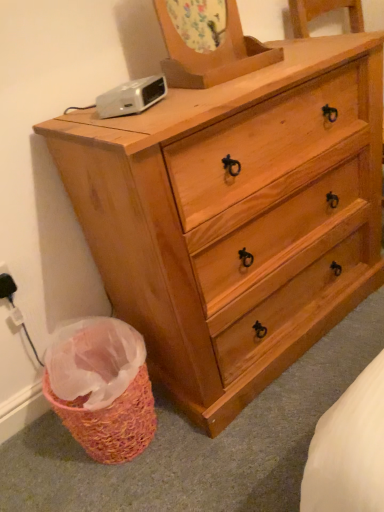
Question: Is black plastic electric outlet at lower left far away from natural wood dresser at center?

Choices:
 (A) yes
 (B) no

Answer: (B)

Question: Is black plastic electric outlet at lower left turned away from natural wood dresser at center?

Choices:
 (A) yes
 (B) no

Answer: (B)

Question: Can we say black plastic electric outlet at lower left lies outside natural wood dresser at center?

Choices:
 (A) yes
 (B) no

Answer: (A)

Question: Is black plastic electric outlet at lower left wider than natural wood dresser at center?

Choices:
 (A) yes
 (B) no

Answer: (B)

Question: From the image's perspective, does black plastic electric outlet at lower left appear lower than natural wood dresser at center?

Choices:
 (A) yes
 (B) no

Answer: (A)

Question: Is point coord(4,295) positioned closer to the camera than point coord(301,47)?

Choices:
 (A) closer
 (B) farther

Answer: (A)

Question: Is black plastic electric outlet at lower left in front of or behind natural wood dresser at center in the image?

Choices:
 (A) front
 (B) behind

Answer: (B)

Question: Is black plastic electric outlet at lower left inside the boundaries of natural wood dresser at center, or outside?

Choices:
 (A) inside
 (B) outside

Answer: (B)

Question: Considering the relative positions of black plastic electric outlet at lower left and natural wood dresser at center in the image provided, is black plastic electric outlet at lower left to the left or to the right of natural wood dresser at center?

Choices:
 (A) left
 (B) right

Answer: (A)

Question: Is natural wood dresser at center spatially inside white plastic clock at upper left, or outside of it?

Choices:
 (A) outside
 (B) inside

Answer: (A)

Question: In terms of width, does natural wood dresser at center look wider or thinner when compared to white plastic clock at upper left?

Choices:
 (A) wide
 (B) thin

Answer: (A)

Question: Is natural wood dresser at center to the left or to the right of white plastic clock at upper left in the image?

Choices:
 (A) left
 (B) right

Answer: (B)

Question: Looking at the image, does natural wood dresser at center seem bigger or smaller compared to white plastic clock at upper left?

Choices:
 (A) big
 (B) small

Answer: (A)

Question: From their relative heights in the image, would you say black plastic electric outlet at lower left is taller or shorter than white plastic clock at upper left?

Choices:
 (A) short
 (B) tall

Answer: (B)

Question: From a real-world perspective, is black plastic electric outlet at lower left above or below white plastic clock at upper left?

Choices:
 (A) below
 (B) above

Answer: (A)